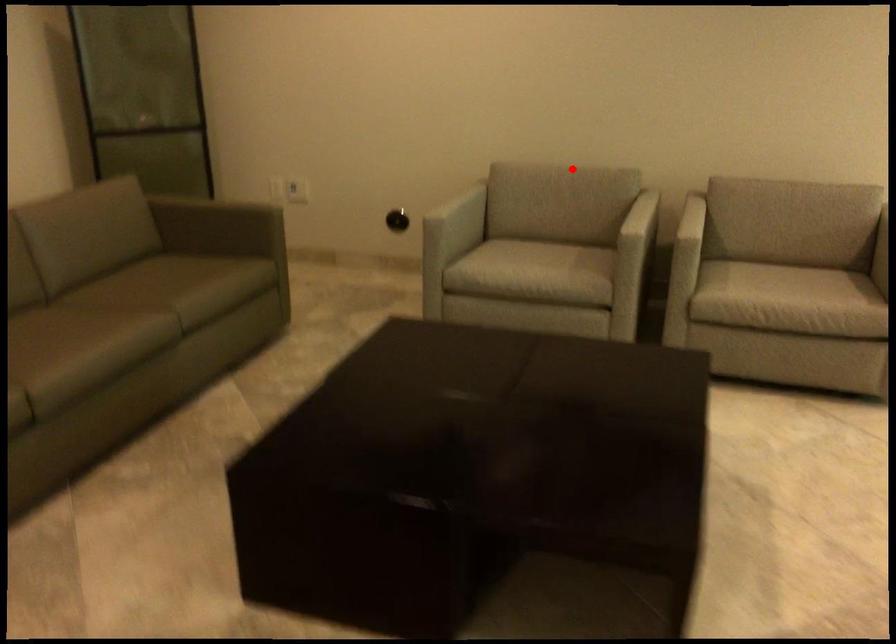
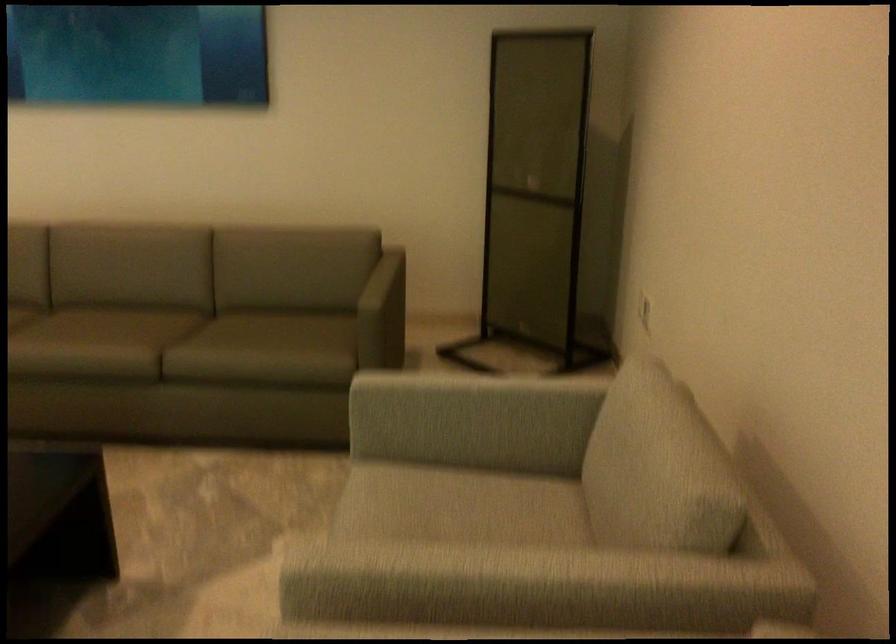
Question: I am providing you with two images of the same scene from different viewpoints. A red point is shown in image1. For the corresponding object point in image2, is it positioned nearer or farther from the camera?

Choices:
 (A) Nearer
 (B) Farther

Answer: (A)